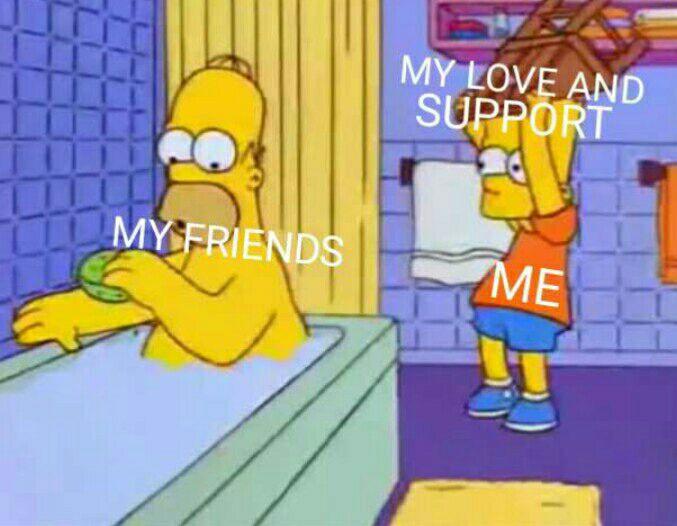
This screenshot has width=677, height=526. What are the coordinates of `wall` in the screenshot? It's located at (91, 135).